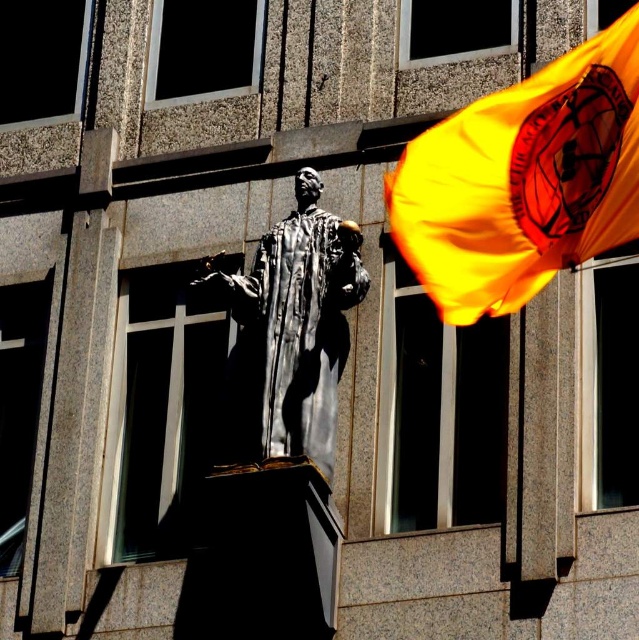
Question: Which point is closer to the camera?

Choices:
 (A) shiny orange flag at upper right
 (B) polished silver statue at center

Answer: (A)

Question: Is shiny orange flag at upper right below polished silver statue at center?

Choices:
 (A) no
 (B) yes

Answer: (A)

Question: Can you confirm if shiny orange flag at upper right is smaller than polished silver statue at center?

Choices:
 (A) no
 (B) yes

Answer: (A)

Question: Is shiny orange flag at upper right to the right of polished silver statue at center from the viewer's perspective?

Choices:
 (A) yes
 (B) no

Answer: (A)